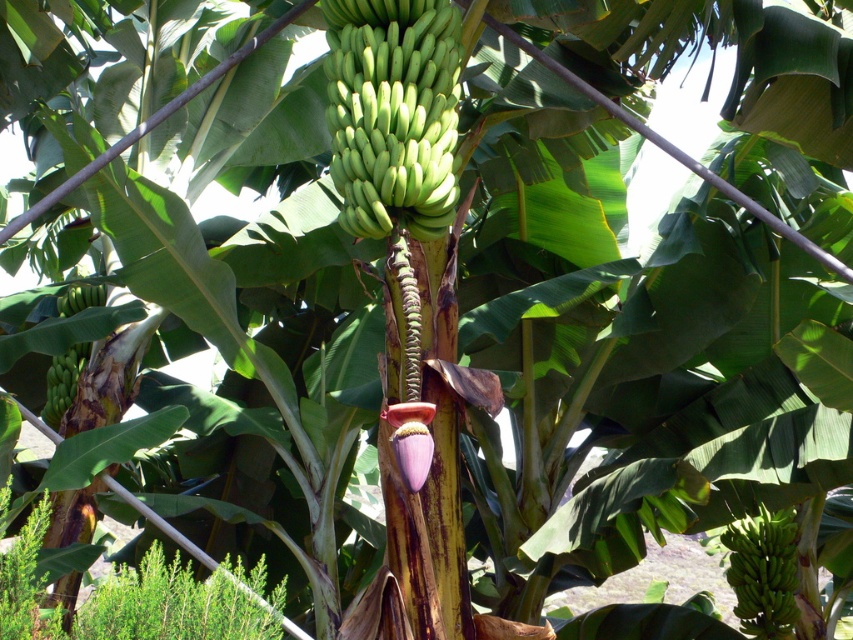
You are a farmer checking the bananas in the field. You notice two clusters of green matte bananas at center and green matte bananas at lower right. Which cluster is positioned to the left side of the other?

The green matte bananas at center are positioned to the left of the green matte bananas at lower right.

You are a farmer checking the banana tree. You notice two groups of green matte bananas at center and green matte bananas at lower right. Which group has a smaller diameter?

The green matte bananas at center is thinner than the green matte bananas at lower right, so the group at center has a smaller diameter.

You are a farmer checking the bananas on your banana tree. You notice two groups of green matte bananas at center and green matte bananas at left. Which group has a larger size?

The green matte bananas at center is bigger than the green matte bananas at left.